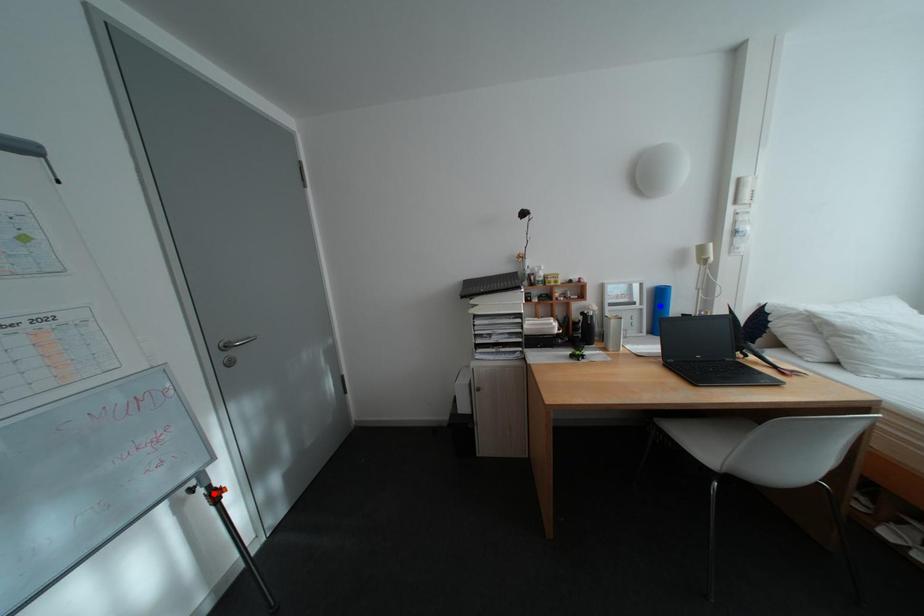
Question: Which of the two points in the image is closer to the camera?

Choices:
 (A) Blue point is closer.
 (B) Red point is closer.

Answer: (B)